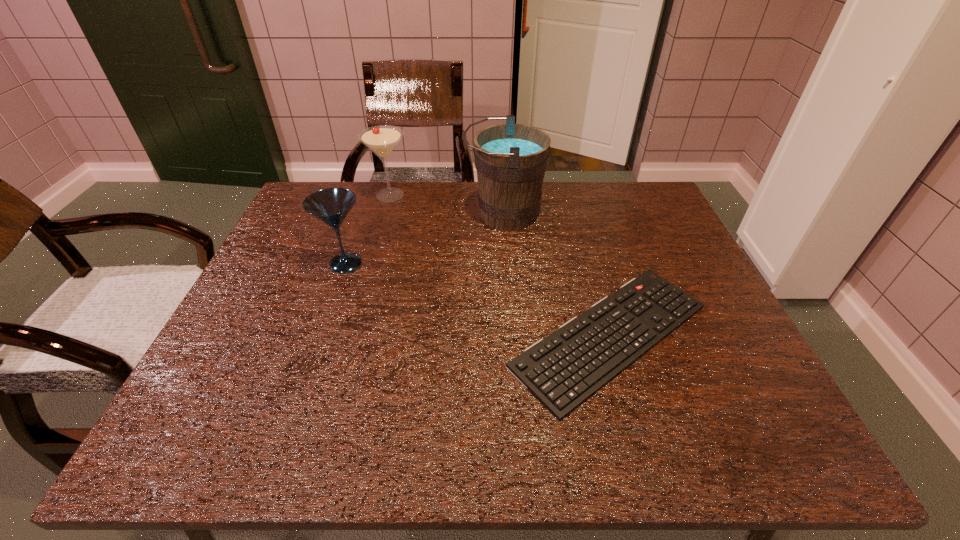
Image resolution: width=960 pixels, height=540 pixels. In the image, there is a desktop. In order to click on free space at the near left corner in this screenshot , I will do `click(180, 426)`.

Locate an element on the screen. free space at the far right corner is located at coordinates (634, 186).

The width and height of the screenshot is (960, 540). I want to click on free space that is in between the nearer martini and the computer keyboard, so click(478, 300).

You are a GUI agent. You are given a task and a screenshot of the screen. Output one action in this format:
    pyautogui.click(x=<x>, y=<y>)
    Task: Click on the vacant area between the farther martini and the nearer martini
    The width and height of the screenshot is (960, 540).
    Given the screenshot: What is the action you would take?
    pyautogui.click(x=368, y=230)

You are a GUI agent. You are given a task and a screenshot of the screen. Output one action in this format:
    pyautogui.click(x=<x>, y=<y>)
    Task: Click on the free spot between the nearer martini and the computer keyboard
    
    Given the screenshot: What is the action you would take?
    pyautogui.click(x=478, y=300)

Find the location of a particular element. This screenshot has width=960, height=540. vacant area that lies between the wine bucket and the shortest object is located at coordinates (558, 275).

The height and width of the screenshot is (540, 960). I want to click on free space that is in between the farther martini and the shortest object, so point(500,265).

The image size is (960, 540). In order to click on vacant space in between the computer keyboard and the tallest object in this screenshot , I will do `click(558, 275)`.

The height and width of the screenshot is (540, 960). In order to click on vacant space in between the farther martini and the shortest object in this screenshot , I will do `click(500, 265)`.

The height and width of the screenshot is (540, 960). Find the location of `free spot between the nearer martini and the farther martini`. free spot between the nearer martini and the farther martini is located at coordinates (368, 230).